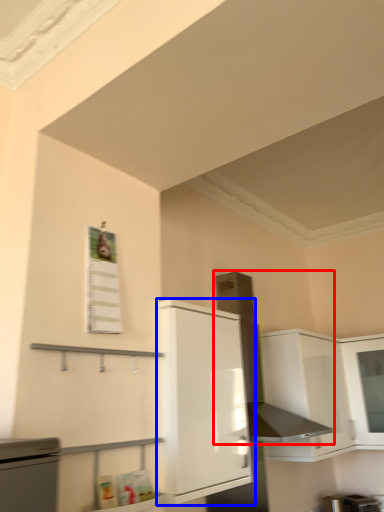
Question: Which object is further to the camera taking this photo, exhaust hood (highlighted by a red box) or cabinetry (highlighted by a blue box)?

Choices:
 (A) exhaust hood
 (B) cabinetry

Answer: (A)